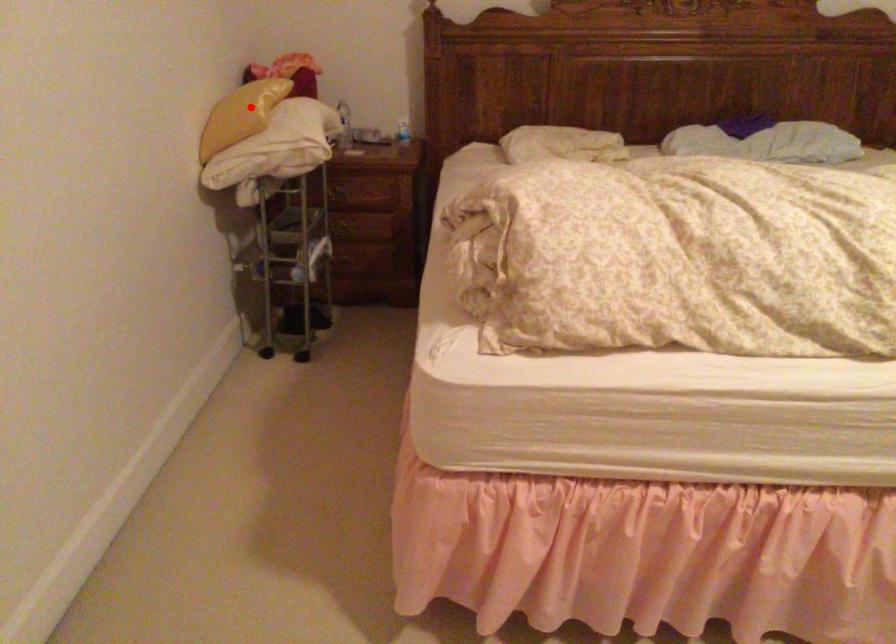
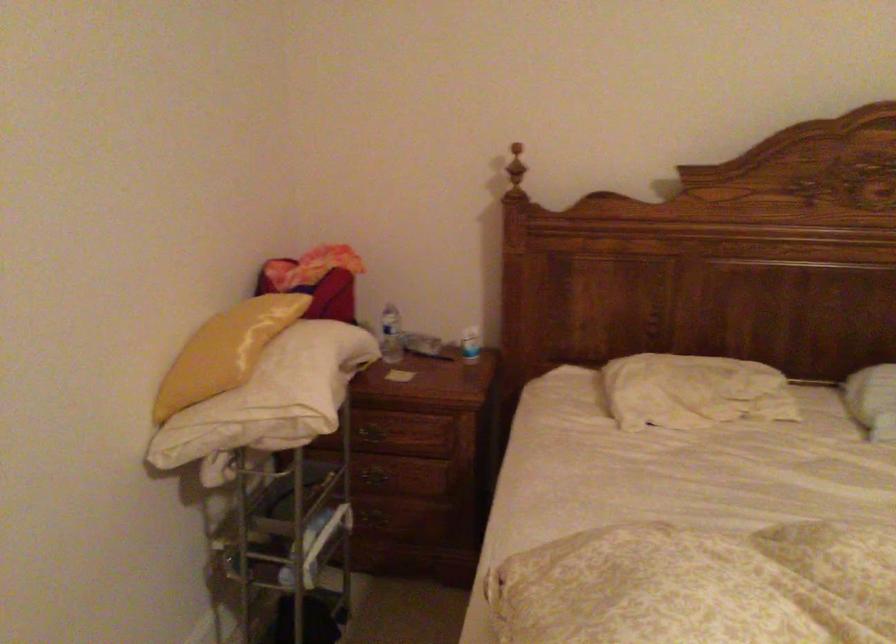
Question: I am providing you with two images of the same scene from different viewpoints. A red point is marked on the first image. Is the red point's position out of view in image 2?

Choices:
 (A) Yes
 (B) No

Answer: (B)